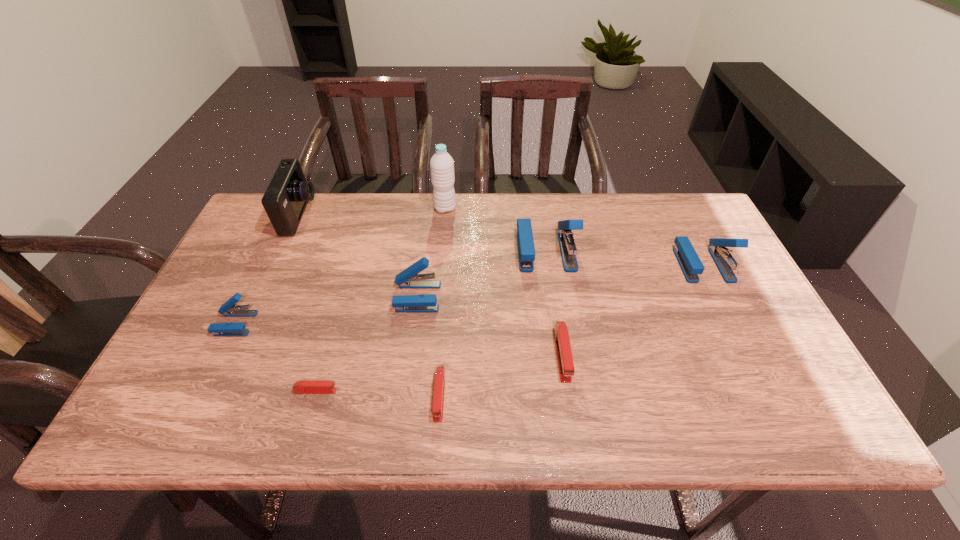
At what (x,y) coordinates should I click in order to perform the action: click on vacant space that is in between the leftmost red stapler and the camera. Please return your answer as a coordinate pair (x, y). The image size is (960, 540). Looking at the image, I should click on (308, 303).

You are a GUI agent. You are given a task and a screenshot of the screen. Output one action in this format:
    pyautogui.click(x=<x>, y=<y>)
    Task: Click on the vacant space in between the fourth stapler from left to right and the rightmost stapler
    The image size is (960, 540).
    Given the screenshot: What is the action you would take?
    pyautogui.click(x=571, y=330)

Where is `vacant area that lies between the tallest stapler and the leftmost stapler`? Image resolution: width=960 pixels, height=540 pixels. vacant area that lies between the tallest stapler and the leftmost stapler is located at coordinates (391, 287).

You are a GUI agent. You are given a task and a screenshot of the screen. Output one action in this format:
    pyautogui.click(x=<x>, y=<y>)
    Task: Click on the vacant space in between the rightmost blue stapler and the second stapler from left to right
    The height and width of the screenshot is (540, 960).
    Given the screenshot: What is the action you would take?
    pyautogui.click(x=510, y=328)

Identify the location of blank region between the white water bottle and the third blue stapler from left to right. (495, 230).

The image size is (960, 540). In order to click on vacant area between the third blue stapler from left to right and the second shortest stapler in this screenshot , I will do `click(492, 323)`.

In order to click on free space between the white water bottle and the fifth tallest stapler in this screenshot , I will do `click(504, 281)`.

Image resolution: width=960 pixels, height=540 pixels. In order to click on the closest object to the fifth shortest stapler in this screenshot , I will do `click(439, 383)`.

At what (x,y) coordinates should I click in order to perform the action: click on object that is the third closest to the tallest stapler. Please return your answer as a coordinate pair (x, y). This screenshot has height=540, width=960. Looking at the image, I should click on (409, 278).

The height and width of the screenshot is (540, 960). I want to click on stapler that is the fifth closest to the third blue stapler from left to right, so click(302, 387).